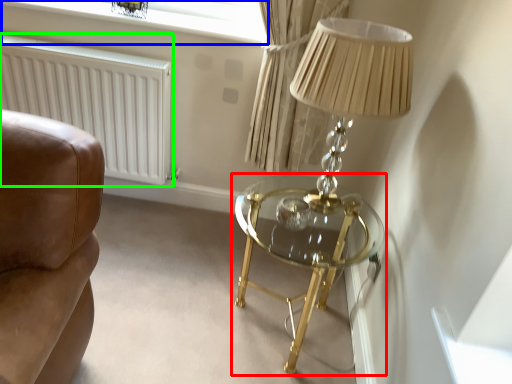
Question: Considering the real-world distances, which object is closest to table (highlighted by a red box)? window screen (highlighted by a blue box) or radiator (highlighted by a green box).

Choices:
 (A) window screen
 (B) radiator

Answer: (B)